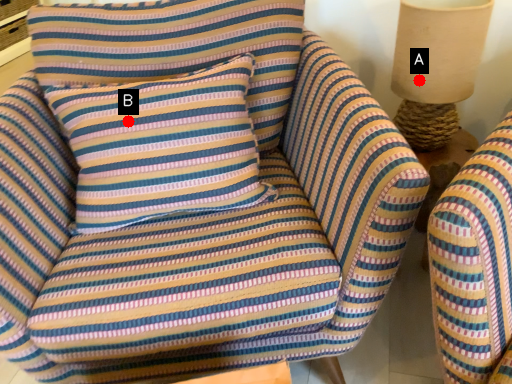
Question: Two points are circled on the image, labeled by A and B beside each circle. Which point is closer to the camera taking this photo?

Choices:
 (A) A is closer
 (B) B is closer

Answer: (B)